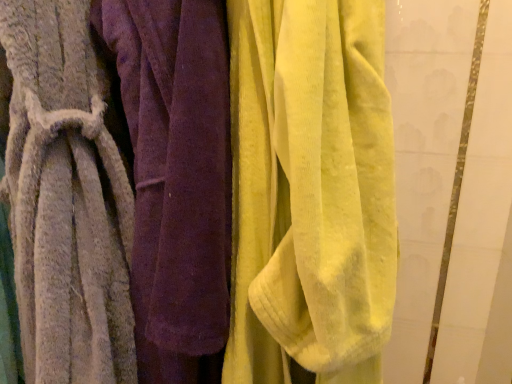
The width and height of the screenshot is (512, 384). I want to click on soft gray towel at left, which is the second towel in left-to-right order, so click(176, 179).

The image size is (512, 384). What are the coordinates of `soft gray towel at left, placed as the 2th towel when sorted from right to left` in the screenshot? It's located at (176, 179).

Which object is positioned more to the right, gray textured towel at left, which ranks as the 1th towel in left-to-right order, or velvet yellow towel at center, positioned as the 1th towel in right-to-left order?

velvet yellow towel at center, positioned as the 1th towel in right-to-left order.

Is point (67, 339) closer or farther from the camera than point (313, 102)?

Point (67, 339) appears to be farther away from the viewer than point (313, 102).

From a real-world perspective, who is located lower, gray textured towel at left, the third towel when ordered from right to left, or velvet yellow towel at center, positioned as the 1th towel in right-to-left order?

gray textured towel at left, the third towel when ordered from right to left.

How different are the orientations of gray textured towel at left, which ranks as the 1th towel in left-to-right order, and velvet yellow towel at center, positioned as the 1th towel in right-to-left order, in degrees?

The facing directions of gray textured towel at left, which ranks as the 1th towel in left-to-right order, and velvet yellow towel at center, positioned as the 1th towel in right-to-left order, are 0.000364 degrees apart.

Considering the relative positions of velvet yellow towel at center, the 3th towel when ordered from left to right, and gray textured towel at left, the third towel when ordered from right to left, in the image provided, is velvet yellow towel at center, the 3th towel when ordered from left to right, in front of gray textured towel at left, the third towel when ordered from right to left,?

Yes, it is.

Consider the image. From a real-world perspective, who is located lower, velvet yellow towel at center, the 3th towel when ordered from left to right, or gray textured towel at left, the third towel when ordered from right to left?

gray textured towel at left, the third towel when ordered from right to left, from a real-world perspective.

Is velvet yellow towel at center, positioned as the 1th towel in right-to-left order, far away from gray textured towel at left, which ranks as the 1th towel in left-to-right order?

No, velvet yellow towel at center, positioned as the 1th towel in right-to-left order, is not far away from gray textured towel at left, which ranks as the 1th towel in left-to-right order.

Can you confirm if velvet yellow towel at center, positioned as the 1th towel in right-to-left order, is wider than gray textured towel at left, which ranks as the 1th towel in left-to-right order?

Incorrect, the width of velvet yellow towel at center, positioned as the 1th towel in right-to-left order, does not surpass that of gray textured towel at left, which ranks as the 1th towel in left-to-right order.

Considering the relative positions of gray textured towel at left, the third towel when ordered from right to left, and soft gray towel at left, which is the second towel in left-to-right order, in the image provided, is gray textured towel at left, the third towel when ordered from right to left, to the left or to the right of soft gray towel at left, which is the second towel in left-to-right order,?

Based on their positions, gray textured towel at left, the third towel when ordered from right to left, is located to the left of soft gray towel at left, which is the second towel in left-to-right order.

Between gray textured towel at left, the third towel when ordered from right to left, and soft gray towel at left, which is the second towel in left-to-right order, which one is positioned in front?

gray textured towel at left, the third towel when ordered from right to left, is more forward.

Can you tell me how much gray textured towel at left, the third towel when ordered from right to left, and soft gray towel at left, placed as the 2th towel when sorted from right to left, differ in facing direction?

The angular difference between gray textured towel at left, the third towel when ordered from right to left, and soft gray towel at left, placed as the 2th towel when sorted from right to left, is 0.000247 degrees.

Considering the sizes of soft gray towel at left, which is the second towel in left-to-right order, and velvet yellow towel at center, the 3th towel when ordered from left to right, in the image, is soft gray towel at left, which is the second towel in left-to-right order, taller or shorter than velvet yellow towel at center, the 3th towel when ordered from left to right,?

Considering their sizes, soft gray towel at left, which is the second towel in left-to-right order, has more height than velvet yellow towel at center, the 3th towel when ordered from left to right.

Find the location of a particular element. the 1st towel to the left of the velvet yellow towel at center, the 3th towel when ordered from left to right, counting from the anchor's position is located at coordinates (176, 179).

Considering the relative positions of soft gray towel at left, which is the second towel in left-to-right order, and velvet yellow towel at center, the 3th towel when ordered from left to right, in the image provided, is soft gray towel at left, which is the second towel in left-to-right order, behind velvet yellow towel at center, the 3th towel when ordered from left to right,?

Yes, it is behind velvet yellow towel at center, the 3th towel when ordered from left to right.

Between velvet yellow towel at center, the 3th towel when ordered from left to right, and soft gray towel at left, placed as the 2th towel when sorted from right to left, which one has larger size?

velvet yellow towel at center, the 3th towel when ordered from left to right, is bigger.

From a real-world perspective, who is located higher, velvet yellow towel at center, the 3th towel when ordered from left to right, or soft gray towel at left, placed as the 2th towel when sorted from right to left?

velvet yellow towel at center, the 3th towel when ordered from left to right, from a real-world perspective.

Does velvet yellow towel at center, positioned as the 1th towel in right-to-left order, have a greater width compared to soft gray towel at left, which is the second towel in left-to-right order?

Indeed, velvet yellow towel at center, positioned as the 1th towel in right-to-left order, has a greater width compared to soft gray towel at left, which is the second towel in left-to-right order.

Which is closer, (x=294, y=48) or (x=184, y=336)?

Point (x=294, y=48) is closer to the camera than point (x=184, y=336).

Between soft gray towel at left, which is the second towel in left-to-right order, and gray textured towel at left, which ranks as the 1th towel in left-to-right order, which one has smaller size?

soft gray towel at left, which is the second towel in left-to-right order.

Considering the sizes of soft gray towel at left, which is the second towel in left-to-right order, and gray textured towel at left, which ranks as the 1th towel in left-to-right order, in the image, is soft gray towel at left, which is the second towel in left-to-right order, wider or thinner than gray textured towel at left, which ranks as the 1th towel in left-to-right order,?

Considering their sizes, soft gray towel at left, which is the second towel in left-to-right order, looks slimmer than gray textured towel at left, which ranks as the 1th towel in left-to-right order.

From the image's perspective, does soft gray towel at left, placed as the 2th towel when sorted from right to left, appear lower than gray textured towel at left, which ranks as the 1th towel in left-to-right order?

No, from the image's perspective, soft gray towel at left, placed as the 2th towel when sorted from right to left, is not below gray textured towel at left, which ranks as the 1th towel in left-to-right order.

From a real-world perspective, between soft gray towel at left, which is the second towel in left-to-right order, and gray textured towel at left, the third towel when ordered from right to left, who is vertically higher?

soft gray towel at left, which is the second towel in left-to-right order, is physically above.

Where is `the 1st towel behind the velvet yellow towel at center, positioned as the 1th towel in right-to-left order`? The width and height of the screenshot is (512, 384). the 1st towel behind the velvet yellow towel at center, positioned as the 1th towel in right-to-left order is located at coordinates (64, 199).

This screenshot has width=512, height=384. In order to click on the 2nd towel to the right of the gray textured towel at left, the third towel when ordered from right to left, counting from the anchor's position in this screenshot , I will do `click(310, 191)`.

Based on their spatial positions, is velvet yellow towel at center, the 3th towel when ordered from left to right, or soft gray towel at left, placed as the 2th towel when sorted from right to left, further from gray textured towel at left, the third towel when ordered from right to left?

velvet yellow towel at center, the 3th towel when ordered from left to right, is further to gray textured towel at left, the third towel when ordered from right to left.

Based on their spatial positions, is soft gray towel at left, placed as the 2th towel when sorted from right to left, or velvet yellow towel at center, the 3th towel when ordered from left to right, further from gray textured towel at left, which ranks as the 1th towel in left-to-right order?

The object further to gray textured towel at left, which ranks as the 1th towel in left-to-right order, is velvet yellow towel at center, the 3th towel when ordered from left to right.

Considering their positions, is velvet yellow towel at center, the 3th towel when ordered from left to right, positioned further to soft gray towel at left, placed as the 2th towel when sorted from right to left, than gray textured towel at left, which ranks as the 1th towel in left-to-right order?

velvet yellow towel at center, the 3th towel when ordered from left to right, is positioned further to the anchor soft gray towel at left, placed as the 2th towel when sorted from right to left.

Looking at the image, which one is located closer to soft gray towel at left, placed as the 2th towel when sorted from right to left, gray textured towel at left, which ranks as the 1th towel in left-to-right order, or velvet yellow towel at center, the 3th towel when ordered from left to right?

The object closer to soft gray towel at left, placed as the 2th towel when sorted from right to left, is gray textured towel at left, which ranks as the 1th towel in left-to-right order.

Which object lies nearer to the anchor point velvet yellow towel at center, positioned as the 1th towel in right-to-left order, gray textured towel at left, which ranks as the 1th towel in left-to-right order, or soft gray towel at left, placed as the 2th towel when sorted from right to left?

soft gray towel at left, placed as the 2th towel when sorted from right to left.

Estimate the real-world distances between objects in this image. Which object is further from velvet yellow towel at center, positioned as the 1th towel in right-to-left order, soft gray towel at left, which is the second towel in left-to-right order, or gray textured towel at left, the third towel when ordered from right to left?

Based on the image, gray textured towel at left, the third towel when ordered from right to left, appears to be further to velvet yellow towel at center, positioned as the 1th towel in right-to-left order.

The height and width of the screenshot is (384, 512). In order to click on towel situated between gray textured towel at left, the third towel when ordered from right to left, and velvet yellow towel at center, positioned as the 1th towel in right-to-left order, from left to right in this screenshot , I will do click(x=176, y=179).